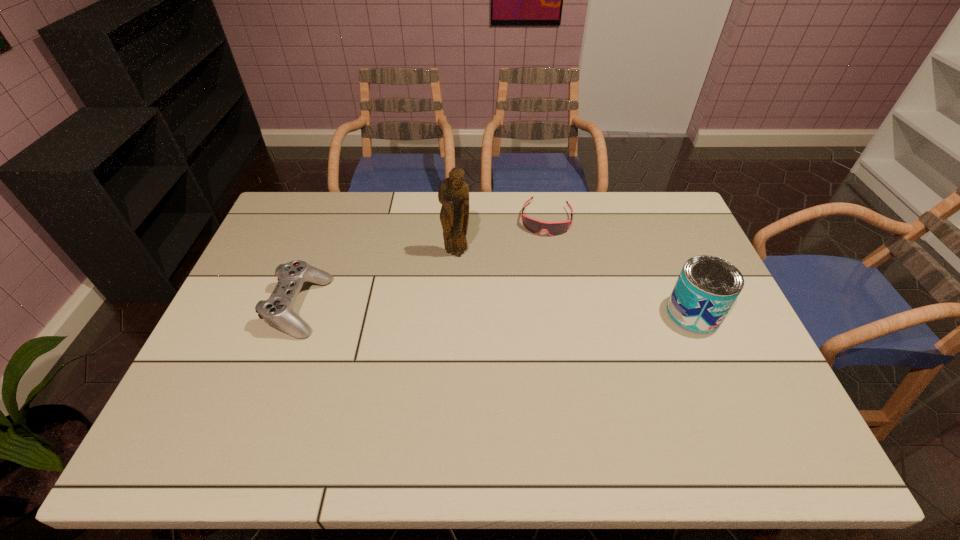
Find the location of a particular element. This screenshot has height=540, width=960. vacant space located 0.220m on the front-facing side of the second object from right to left is located at coordinates (535, 283).

The image size is (960, 540). In order to click on vacant region located 0.270m on the front-facing side of the second object from right to left in this screenshot , I will do [x=533, y=295].

Find the location of a particular element. Image resolution: width=960 pixels, height=540 pixels. free spot located on the front-facing side of the second object from right to left is located at coordinates (529, 316).

Identify the location of vacant space located 0.270m on the front-facing side of the third object from right to left. (438, 326).

Find the location of `free region located 0.120m on the front-facing side of the third object from right to left`. free region located 0.120m on the front-facing side of the third object from right to left is located at coordinates (447, 287).

Identify the location of vacant space positioned 0.210m on the front-facing side of the third object from right to left. The image size is (960, 540). (442, 309).

The height and width of the screenshot is (540, 960). Find the location of `object present at the far edge`. object present at the far edge is located at coordinates (535, 226).

At what (x,y) coordinates should I click in order to perform the action: click on object at the left edge. Please return your answer as a coordinate pair (x, y). Looking at the image, I should click on (277, 311).

Where is `object positioned at the right edge`? object positioned at the right edge is located at coordinates (707, 287).

The width and height of the screenshot is (960, 540). I want to click on free region at the far edge of the desktop, so click(x=416, y=201).